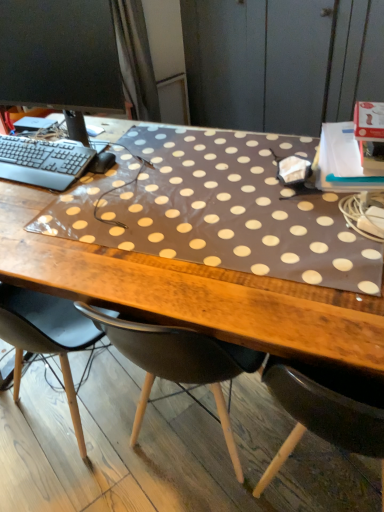
Question: Is black plastic keyboard at left taller or shorter than brown fabric dresser at upper right?

Choices:
 (A) tall
 (B) short

Answer: (B)

Question: Visually, is black plastic keyboard at left positioned to the left or to the right of brown fabric dresser at upper right?

Choices:
 (A) right
 (B) left

Answer: (B)

Question: Which object is the closest to the black glossy monitor at upper left?

Choices:
 (A) brown polka dot mat at center
 (B) black plastic keyboard at left
 (C) black matte mouse at center
 (D) brown fabric dresser at upper right

Answer: (B)

Question: Estimate the real-world distances between objects in this image. Which object is closer to the brown fabric dresser at upper right?

Choices:
 (A) black plastic keyboard at left
 (B) black matte mouse at center
 (C) black glossy monitor at upper left
 (D) brown polka dot mat at center

Answer: (C)